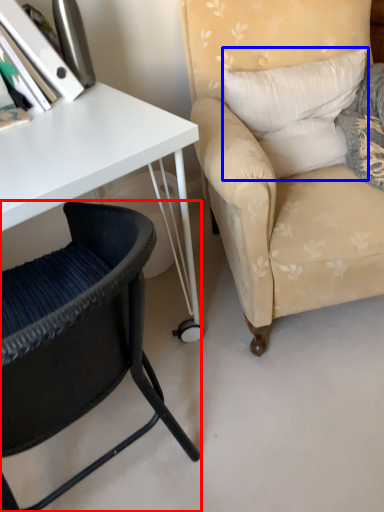
Question: Which object is closer to the camera taking this photo, chair (highlighted by a red box) or pillow (highlighted by a blue box)?

Choices:
 (A) chair
 (B) pillow

Answer: (A)